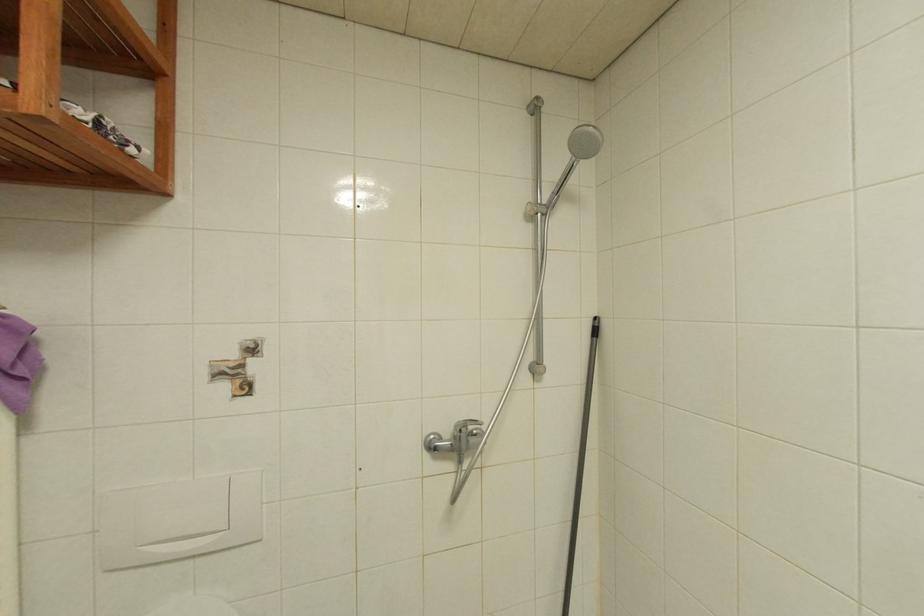
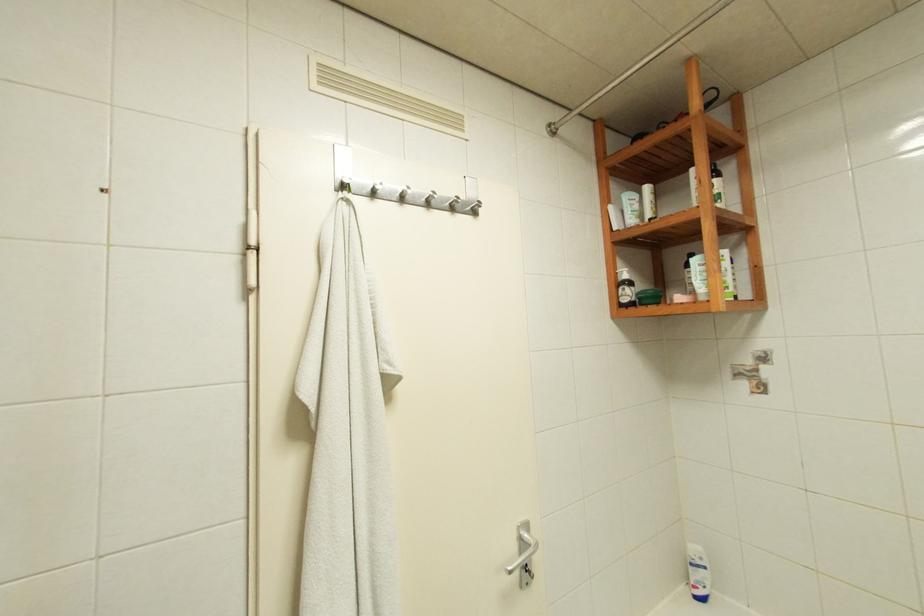
Question: The first image is from the beginning of the video and the second image is from the end. How did the camera likely rotate when shooting the video?

Choices:
 (A) Left
 (B) Right
 (C) Up
 (D) Down

Answer: (B)